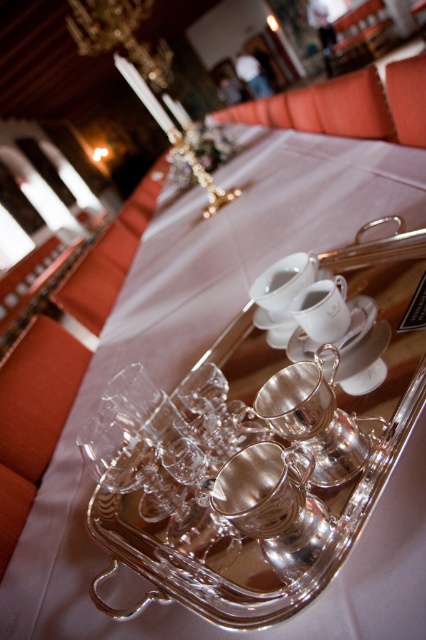
The height and width of the screenshot is (640, 426). What do you see at coordinates (230, 458) in the screenshot? I see `clear glass cups at center` at bounding box center [230, 458].

Which of these two, clear glass cups at center or white porcelain saucer at center, stands taller?

clear glass cups at center

Is point (331, 401) farther from camera compared to point (354, 307)?

That is False.

In order to click on clear glass cups at center in this screenshot , I will do `click(230, 458)`.